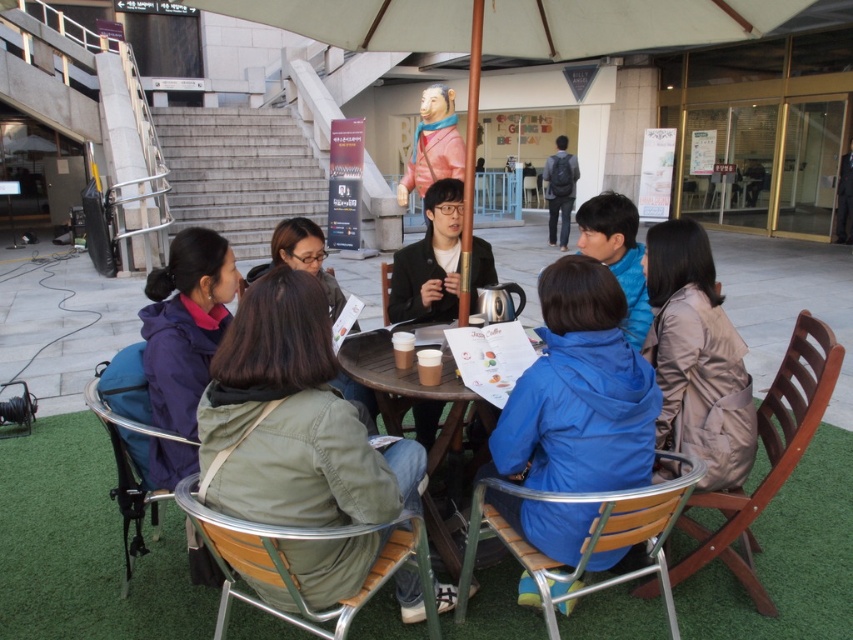
Can you confirm if green fabric chair at center is wider than wooden chair at center?

Correct, the width of green fabric chair at center exceeds that of wooden chair at center.

Is point (283, 563) positioned behind point (383, 280)?

No.

Does point (221, 632) come closer to viewer compared to point (383, 276)?

Yes, it is in front of point (383, 276).

Where is `green fabric chair at center`? green fabric chair at center is located at coordinates (287, 560).

Who is positioned more to the left, brown leather jacket at right or dark gray backpack at center?

brown leather jacket at right is more to the left.

Can you confirm if brown leather jacket at right is taller than dark gray backpack at center?

In fact, brown leather jacket at right may be shorter than dark gray backpack at center.

Which is behind, point (717, 291) or point (552, 172)?

The point (552, 172) is behind.

Locate an element on the screen. The width and height of the screenshot is (853, 640). brown leather jacket at right is located at coordinates (695, 356).

Is point (646, 496) positioned behind point (558, 164)?

No.

Is point (651, 492) in front of point (550, 179)?

That is True.

Find the location of a particular element. Image resolution: width=853 pixels, height=640 pixels. wooden chair at lower right is located at coordinates (587, 536).